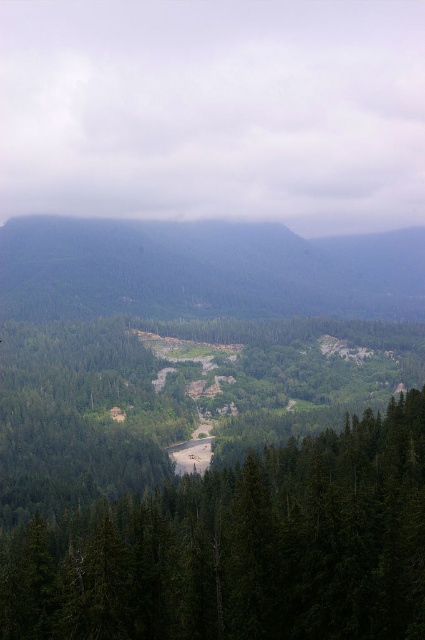
Is green matte tree at center positioned in front of green forested hillside at center?

Yes, it is in front of green forested hillside at center.

Looking at this image, who is more distant from viewer, (184, 616) or (65, 316)?

Positioned behind is point (65, 316).

What do you see at coordinates (241, 547) in the screenshot? The height and width of the screenshot is (640, 425). I see `green matte tree at center` at bounding box center [241, 547].

Where is `green matte tree at center`? Image resolution: width=425 pixels, height=640 pixels. green matte tree at center is located at coordinates (241, 547).